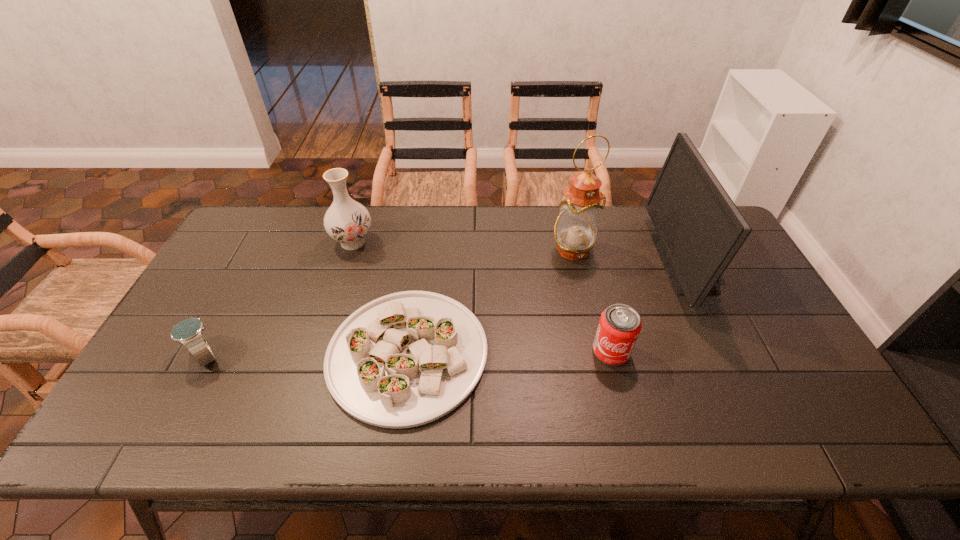
Locate an element on the screen. This screenshot has width=960, height=540. free space that satisfies the following two spatial constraints: 1. on the screen side of the computer monitor; 2. on the front side of the watch is located at coordinates (732, 356).